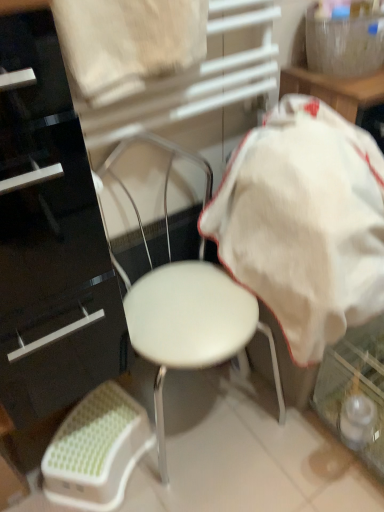
Question: Considering the relative sizes of white plastic bar stool at lower left and white fabric at upper center in the image provided, is white plastic bar stool at lower left shorter than white fabric at upper center?

Choices:
 (A) yes
 (B) no

Answer: (A)

Question: Is white plastic bar stool at lower left closer to camera compared to white fabric at upper center?

Choices:
 (A) yes
 (B) no

Answer: (B)

Question: Considering the relative sizes of white plastic bar stool at lower left and white fabric at upper center in the image provided, is white plastic bar stool at lower left wider than white fabric at upper center?

Choices:
 (A) no
 (B) yes

Answer: (B)

Question: Is white fabric at upper center located within white plastic bar stool at lower left?

Choices:
 (A) no
 (B) yes

Answer: (A)

Question: Is white plastic bar stool at lower left positioned with its back to white fabric at upper center?

Choices:
 (A) no
 (B) yes

Answer: (A)

Question: Is white fabric at upper center in front of or behind white plastic bar stool at lower left in the image?

Choices:
 (A) front
 (B) behind

Answer: (A)

Question: Is point (172, 31) closer or farther from the camera than point (97, 449)?

Choices:
 (A) closer
 (B) farther

Answer: (A)

Question: Is white fabric at upper center inside the boundaries of white plastic bar stool at lower left, or outside?

Choices:
 (A) inside
 (B) outside

Answer: (B)

Question: From the image's perspective, relative to white plastic bar stool at lower left, is white fabric at upper center above or below?

Choices:
 (A) below
 (B) above

Answer: (B)

Question: Relative to white matte chair at center, is white plastic bar stool at lower left in front or behind?

Choices:
 (A) front
 (B) behind

Answer: (B)

Question: In terms of size, does white plastic bar stool at lower left appear bigger or smaller than white matte chair at center?

Choices:
 (A) big
 (B) small

Answer: (B)

Question: In terms of width, does white plastic bar stool at lower left look wider or thinner when compared to white matte chair at center?

Choices:
 (A) thin
 (B) wide

Answer: (A)

Question: Is white plastic bar stool at lower left situated inside white matte chair at center or outside?

Choices:
 (A) inside
 (B) outside

Answer: (B)

Question: From a real-world perspective, is white cotton blanket at center positioned above or below glossy black dresser at left?

Choices:
 (A) above
 (B) below

Answer: (B)

Question: Considering the positions of white cotton blanket at center and glossy black dresser at left in the image, is white cotton blanket at center wider or thinner than glossy black dresser at left?

Choices:
 (A) thin
 (B) wide

Answer: (B)